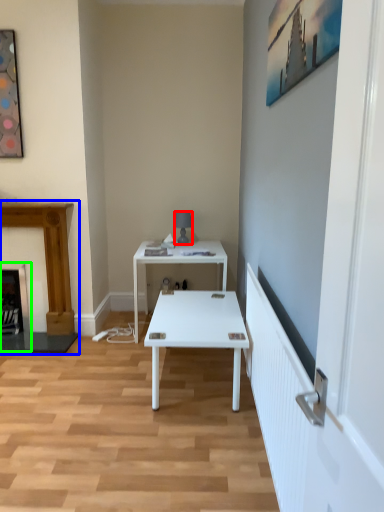
Question: Which is farther away from lamp (highlighted by a red box)? fireplace (highlighted by a blue box) or fireplace (highlighted by a green box)?

Choices:
 (A) fireplace
 (B) fireplace

Answer: (B)